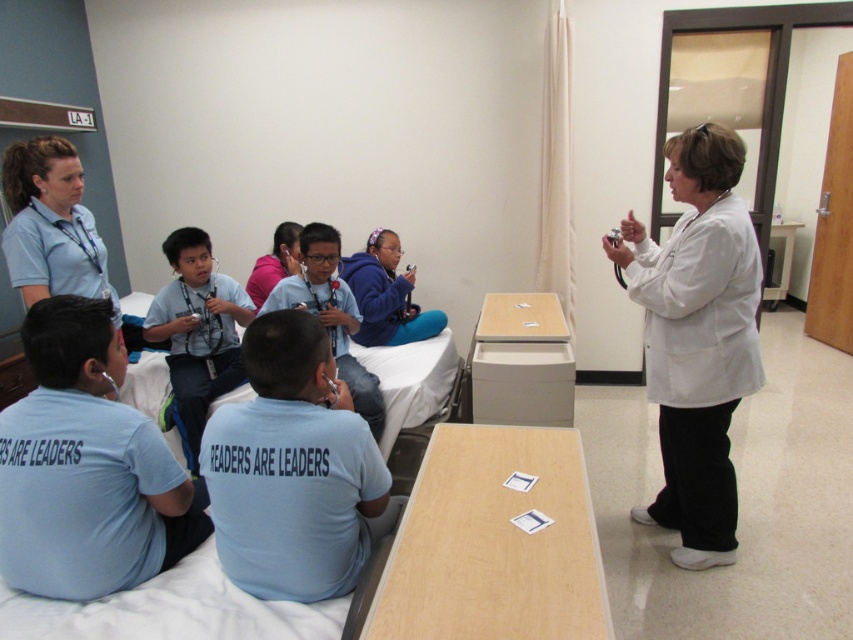
Between light blue cotton shirt at lower left and white matte coat at right, which one has less height?

light blue cotton shirt at lower left is shorter.

Does light blue cotton shirt at lower left have a lesser height compared to white matte coat at right?

Correct, light blue cotton shirt at lower left is not as tall as white matte coat at right.

Is point (84, 420) farther from viewer compared to point (755, 330)?

No, (84, 420) is closer to viewer.

Image resolution: width=853 pixels, height=640 pixels. Find the location of `light blue cotton shirt at lower left`. light blue cotton shirt at lower left is located at coordinates (86, 467).

How distant is light blue cotton shirt at center from matte white coat at center?

light blue cotton shirt at center and matte white coat at center are 3.73 feet apart.

Who is more forward, (312, 552) or (277, 305)?

Point (312, 552) is in front.

Locate an element on the screen. This screenshot has width=853, height=640. light blue cotton shirt at center is located at coordinates (293, 468).

Does light blue cotton shirt at center have a greater width compared to pink fabric shirt at center?

Correct, the width of light blue cotton shirt at center exceeds that of pink fabric shirt at center.

Between light blue cotton shirt at center and pink fabric shirt at center, which one appears on the left side from the viewer's perspective?

From the viewer's perspective, pink fabric shirt at center appears more on the left side.

The width and height of the screenshot is (853, 640). What do you see at coordinates (293, 468) in the screenshot?
I see `light blue cotton shirt at center` at bounding box center [293, 468].

Locate an element on the screen. light blue cotton shirt at center is located at coordinates tap(293, 468).